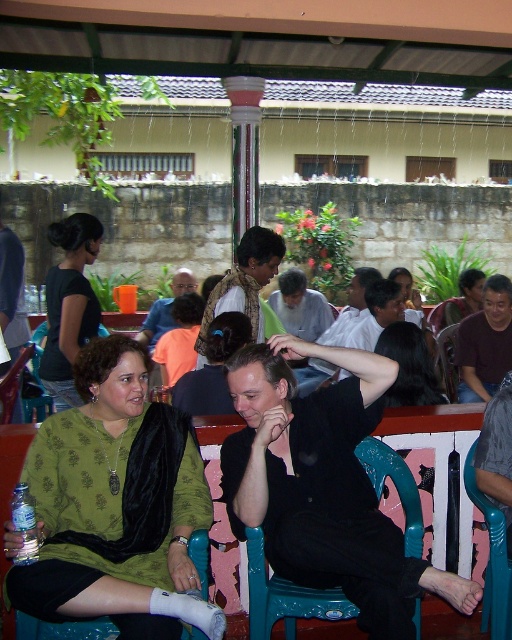
The image size is (512, 640). What do you see at coordinates (286, 596) in the screenshot?
I see `teal plastic chair at center` at bounding box center [286, 596].

Who is more forward, (249, 616) or (471, 362)?

Point (249, 616) is in front.

Is point (417, 525) more distant than point (501, 323)?

No, it is in front of (501, 323).

Locate an element on the screen. The image size is (512, 640). teal plastic chair at center is located at coordinates (286, 596).

Which is in front, point (419, 360) or point (307, 339)?

Point (419, 360) is in front.

Is point (409, 356) closer to camera compared to point (287, 292)?

Yes, it is in front of point (287, 292).

Locate an element on the screen. black hair at center is located at coordinates (409, 365).

Who is positioned more to the left, black matte shirt at center or metallic silver chair at lower right?

Positioned to the left is black matte shirt at center.

Between point (274, 490) and point (445, 360), which one is positioned in front?

Positioned in front is point (274, 490).

Identify the location of black matte shirt at center. (324, 484).